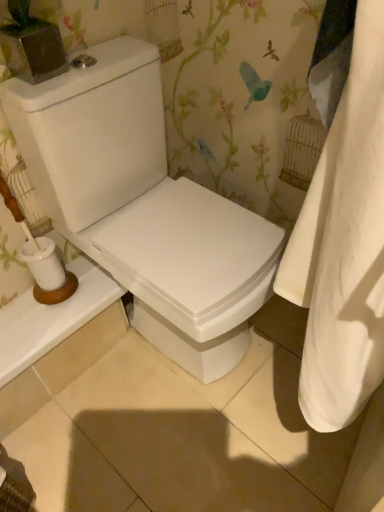
You are a GUI agent. You are given a task and a screenshot of the screen. Output one action in this format:
    pyautogui.click(x=<x>, y=<y>)
    Task: Click on the white glossy toilet at center
    The height and width of the screenshot is (512, 384).
    Given the screenshot: What is the action you would take?
    pyautogui.click(x=143, y=206)

This screenshot has height=512, width=384. Describe the element at coordinates (143, 206) in the screenshot. I see `white glossy toilet at center` at that location.

At what (x,y) coordinates should I click in order to perform the action: click on white glossy toilet at center. Please return your answer as a coordinate pair (x, y). Looking at the image, I should click on (143, 206).